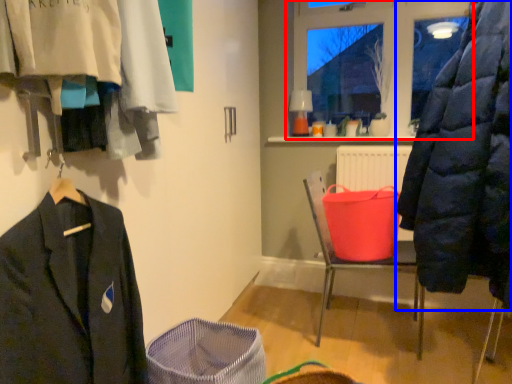
Question: Among these objects, which one is nearest to the camera, window (highlighted by a red box) or coat (highlighted by a blue box)?

Choices:
 (A) window
 (B) coat

Answer: (B)